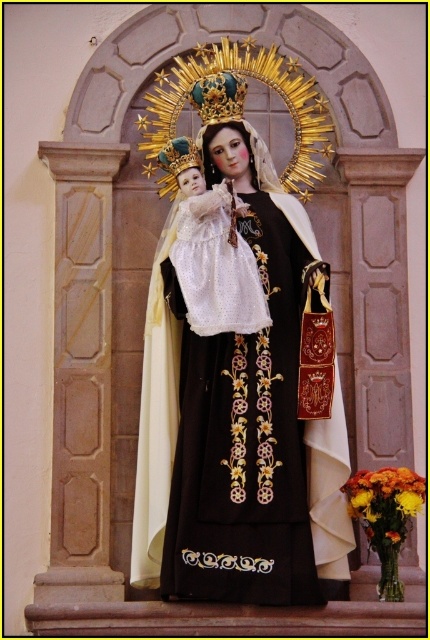
How much distance is there between black satin dress at center and gold metallic crown at upper center?

black satin dress at center is 11.70 meters from gold metallic crown at upper center.

Between point (229, 506) and point (199, 83), which one is positioned behind?

The point (199, 83) is more distant.

This screenshot has width=430, height=640. What are the coordinates of `black satin dress at center` in the screenshot? It's located at (243, 442).